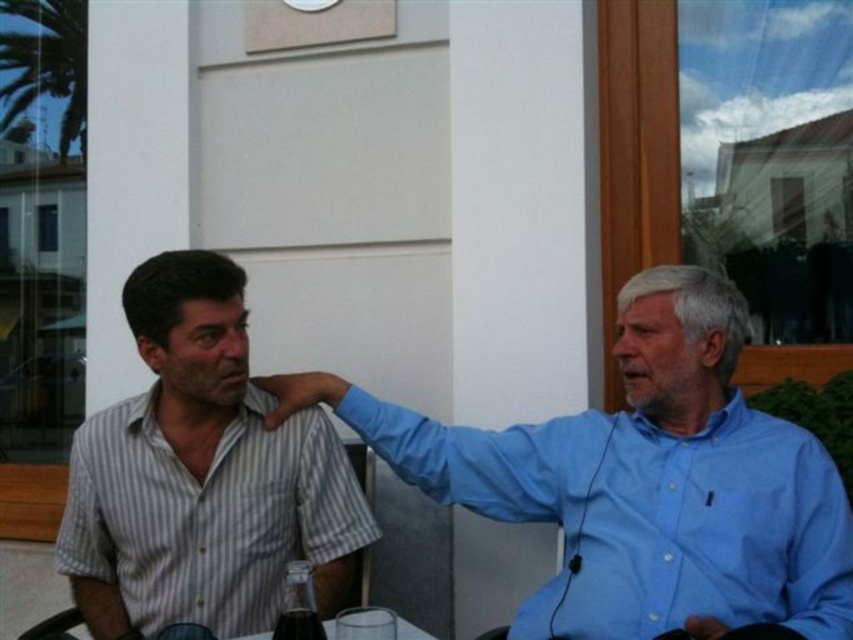
Between blue cotton shirt at right and translucent glass bottle at lower center, which one is positioned higher?

Positioned higher is blue cotton shirt at right.

Between point (608, 426) and point (281, 608), which one is positioned behind?

The point (608, 426) is more distant.

Who is more distant from viewer, (x=834, y=552) or (x=283, y=589)?

The point (x=283, y=589) is behind.

Identify the location of blue cotton shirt at right. The height and width of the screenshot is (640, 853). click(646, 515).

Between point (618, 556) and point (280, 557), which one is positioned in front?

Point (618, 556) is more forward.

From the picture: How distant is blue cotton shirt at right from striped cotton shirt at left?

They are 19.01 inches apart.

Does point (746, 420) come in front of point (247, 440)?

Yes, it is in front of point (247, 440).

You are a GUI agent. You are given a task and a screenshot of the screen. Output one action in this format:
    pyautogui.click(x=<x>, y=<y>)
    Task: Click on the blue cotton shirt at right
    The height and width of the screenshot is (640, 853).
    Given the screenshot: What is the action you would take?
    pyautogui.click(x=646, y=515)

Can you confirm if translucent glass bottle at lower center is positioned to the left of clear glass table at center?

Correct, you'll find translucent glass bottle at lower center to the left of clear glass table at center.

Does translucent glass bottle at lower center appear on the right side of clear glass table at center?

No, translucent glass bottle at lower center is not to the right of clear glass table at center.

The image size is (853, 640). Find the location of `translucent glass bottle at lower center`. translucent glass bottle at lower center is located at coordinates (299, 605).

Locate an element on the screen. The image size is (853, 640). translucent glass bottle at lower center is located at coordinates (299, 605).